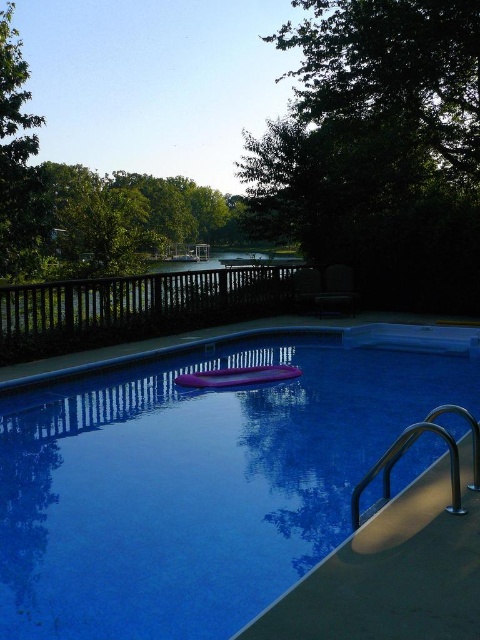
Consider the image. You are planning to place a new bench in the backyard. The bench is 1.2 meters wide. You want to place it where there is enough space. Based on the image, which area between the green leafy tree at upper right and the purple rubber mat at center has enough space for the bench?

The green leafy tree at upper right might be wider than the purple rubber mat at center. Since the bench is 1.2 meters wide, the area near the green leafy tree at upper right likely has enough space if its width accommodates the bench.

You are standing at the edge of the swimming pool in the backyard scene. You notice a point marked at coordinates (x=380, y=147). What object is located at that point?

The point at coordinates (x=380, y=147) corresponds to the green leafy tree at upper right.

You are standing at the edge of the glossy plastic pool at center and want to throw a ball to your friend who is standing 5 meters away from the pool. Can you reach them by throwing the ball from where you are?

The glossy plastic pool at center is 4.29 meters away from the camera. Since your friend is 5 meters away from the pool, you would need to throw the ball a total distance of approximately 9.29 meters. Whether you can reach them depends on your throwing ability, but the distance is quite far.